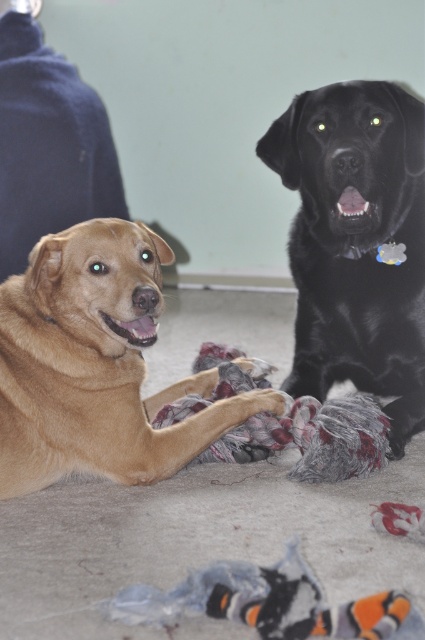
Question: Is golden brown fur at center above black glossy dog at upper right?

Choices:
 (A) yes
 (B) no

Answer: (B)

Question: Which point is farther to the camera?

Choices:
 (A) (161, 291)
 (B) (387, 113)

Answer: (B)

Question: Can you confirm if golden brown fur at center is positioned to the right of black glossy dog at upper right?

Choices:
 (A) no
 (B) yes

Answer: (A)

Question: Which of the following is the closest to the observer?

Choices:
 (A) golden brown fur at center
 (B) black glossy dog at upper right

Answer: (A)

Question: Is golden brown fur at center to the left of black glossy dog at upper right from the viewer's perspective?

Choices:
 (A) yes
 (B) no

Answer: (A)